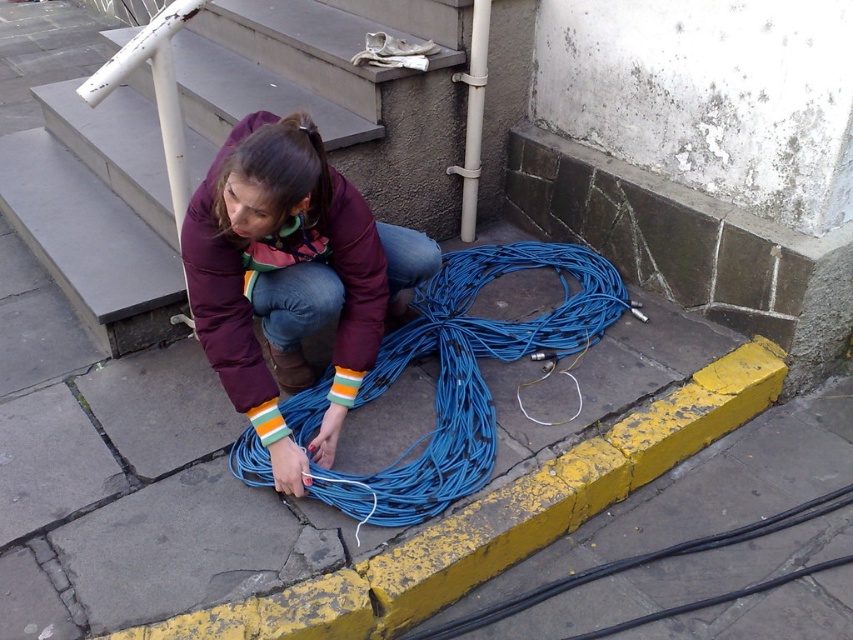
Question: Which object is positioned farthest from the yellow painted curb at lower center?

Choices:
 (A) concrete stairs at center
 (B) matte purple jacket at center

Answer: (A)

Question: Among these objects, which one is nearest to the camera?

Choices:
 (A) matte purple jacket at center
 (B) yellow painted curb at lower center
 (C) blue rubber wire at lower center

Answer: (B)

Question: Does matte purple jacket at center come in front of blue rubber wire at lower center?

Choices:
 (A) no
 (B) yes

Answer: (B)

Question: Is matte purple jacket at center above yellow painted curb at lower center?

Choices:
 (A) yes
 (B) no

Answer: (A)

Question: Does concrete stairs at center appear on the right side of yellow painted curb at lower center?

Choices:
 (A) yes
 (B) no

Answer: (B)

Question: Which point is closer to the camera?

Choices:
 (A) matte purple jacket at center
 (B) yellow painted curb at lower center

Answer: (B)